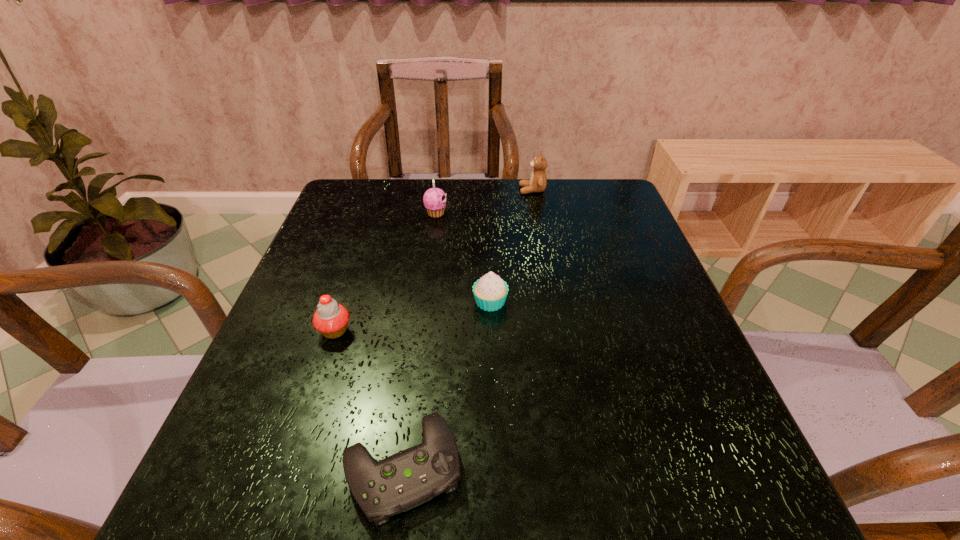
Image resolution: width=960 pixels, height=540 pixels. Identify the location of cupcake that is the closest to the nearest cupcake. (490, 292).

Locate an element on the screen. cupcake object that ranks as the second closest to the rightmost object is located at coordinates click(x=490, y=292).

You are a GUI agent. You are given a task and a screenshot of the screen. Output one action in this format:
    pyautogui.click(x=<x>, y=<y>)
    Task: Click on the blank space that satisfies the following two spatial constraints: 1. on the face of the farthest cupcake; 2. on the back side of the control
    
    Given the screenshot: What is the action you would take?
    pyautogui.click(x=401, y=468)

The width and height of the screenshot is (960, 540). In order to click on vacant space that satisfies the following two spatial constraints: 1. on the face of the third nearest object; 2. on the left side of the second cupcake from right to left in this screenshot , I will do `click(423, 302)`.

Where is `free space that satisfies the following two spatial constraints: 1. on the back side of the second object from right to left; 2. on the face of the second cupcake from left to right`? The height and width of the screenshot is (540, 960). free space that satisfies the following two spatial constraints: 1. on the back side of the second object from right to left; 2. on the face of the second cupcake from left to right is located at coordinates (488, 213).

This screenshot has height=540, width=960. I want to click on vacant point that satisfies the following two spatial constraints: 1. on the back side of the third nearest object; 2. on the left side of the control, so click(x=424, y=302).

Find the location of a particular element. The width and height of the screenshot is (960, 540). free point that satisfies the following two spatial constraints: 1. on the face of the second farthest cupcake; 2. on the right side of the fourth nearest object is located at coordinates (423, 302).